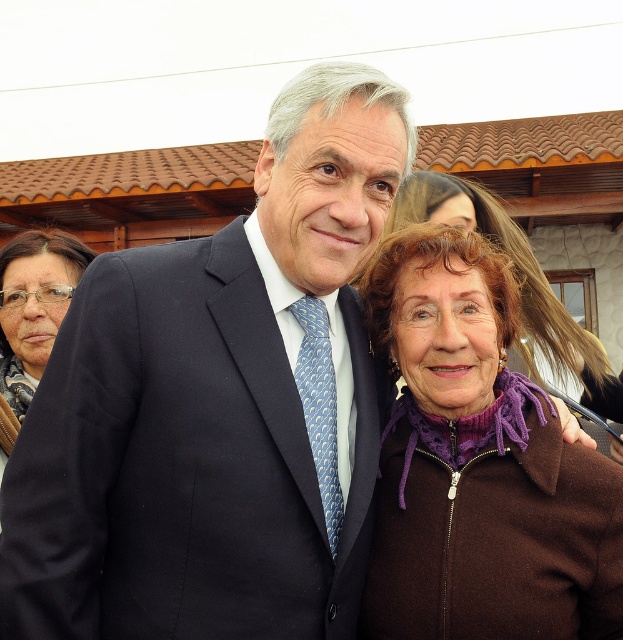
You are a photographer at this event and need to adjust your camera focus. The dark blue suit at center and the matte black jacket at upper left are both in your frame. Which object should you focus on first if you want to capture the closer one?

The dark blue suit at center should be focused on first because it is closer to the photographer than the matte black jacket at upper left, as indicated by its larger size in the frame.

From the picture: You are a photographer at the event and want to capture a photo that includes both the matte black jacket at upper left and the purple fleece jacket at lower right. Based on their positions, which jacket is closer to the bottom of the image?

The matte black jacket at upper left is positioned under the purple fleece jacket at lower right, so the purple fleece jacket at lower right is closer to the bottom of the image.